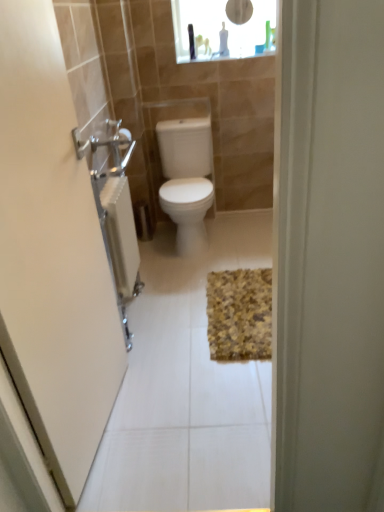
Question: Does yellow textured bath mat at center contain transparent glass medicine cabinet at upper center?

Choices:
 (A) no
 (B) yes

Answer: (A)

Question: Is yellow textured bath mat at center oriented away from transparent glass medicine cabinet at upper center?

Choices:
 (A) yes
 (B) no

Answer: (B)

Question: Is yellow textured bath mat at center taller than transparent glass medicine cabinet at upper center?

Choices:
 (A) no
 (B) yes

Answer: (A)

Question: Is yellow textured bath mat at center positioned far away from transparent glass medicine cabinet at upper center?

Choices:
 (A) yes
 (B) no

Answer: (A)

Question: Considering the relative sizes of yellow textured bath mat at center and transparent glass medicine cabinet at upper center in the image provided, is yellow textured bath mat at center shorter than transparent glass medicine cabinet at upper center?

Choices:
 (A) yes
 (B) no

Answer: (A)

Question: From the image's perspective, is brushed metal towel rack at left above or below white glossy toilet at center?

Choices:
 (A) below
 (B) above

Answer: (A)

Question: Looking at their shapes, would you say brushed metal towel rack at left is wider or thinner than white glossy toilet at center?

Choices:
 (A) wide
 (B) thin

Answer: (B)

Question: Is brushed metal towel rack at left in front of or behind white glossy toilet at center in the image?

Choices:
 (A) front
 (B) behind

Answer: (A)

Question: From a real-world perspective, is brushed metal towel rack at left physically located above or below white glossy toilet at center?

Choices:
 (A) below
 (B) above

Answer: (B)

Question: Relative to transparent glass medicine cabinet at upper center, is white glossy toilet at center in front or behind?

Choices:
 (A) behind
 (B) front

Answer: (B)

Question: From the image's perspective, relative to transparent glass medicine cabinet at upper center, is white glossy toilet at center above or below?

Choices:
 (A) below
 (B) above

Answer: (A)

Question: Do you think white glossy toilet at center is within transparent glass medicine cabinet at upper center, or outside of it?

Choices:
 (A) outside
 (B) inside

Answer: (A)

Question: Is white glossy toilet at center to the left or to the right of transparent glass medicine cabinet at upper center in the image?

Choices:
 (A) right
 (B) left

Answer: (B)

Question: Is transparent glass medicine cabinet at upper center taller or shorter than yellow textured bath mat at center?

Choices:
 (A) tall
 (B) short

Answer: (A)

Question: In terms of size, does transparent glass medicine cabinet at upper center appear bigger or smaller than yellow textured bath mat at center?

Choices:
 (A) big
 (B) small

Answer: (A)